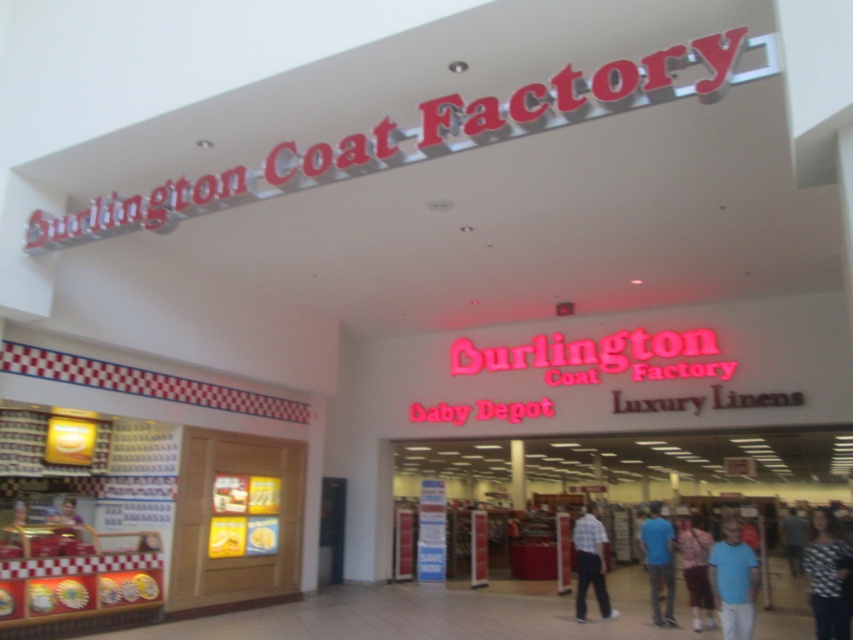
This screenshot has width=853, height=640. Identify the location of blue shirt at center. (659, 561).

Is point (657, 554) farther from camera compared to point (788, 532)?

No, it is in front of (788, 532).

Which is behind, point (654, 611) or point (801, 560)?

Positioned behind is point (801, 560).

Locate an element on the screen. blue shirt at center is located at coordinates (659, 561).

Is the position of blue cotton shirt at lower right more distant than that of blue shirt at center?

That is False.

Is point (728, 570) positioned before point (654, 620)?

Yes, point (728, 570) is closer to viewer.

What do you see at coordinates (733, 580) in the screenshot?
I see `blue cotton shirt at lower right` at bounding box center [733, 580].

You are a GUI agent. You are given a task and a screenshot of the screen. Output one action in this format:
    pyautogui.click(x=<x>, y=<y>)
    Task: Click on the blue cotton shirt at lower right
    Image resolution: width=853 pixels, height=640 pixels.
    Given the screenshot: What is the action you would take?
    pyautogui.click(x=733, y=580)

Does point (825, 509) come closer to viewer compared to point (660, 522)?

That is False.

Is patterned fabric shirt at lower right to the left of blue shirt at center from the viewer's perspective?

In fact, patterned fabric shirt at lower right is to the right of blue shirt at center.

Where is `patterned fabric shirt at lower right`? This screenshot has width=853, height=640. patterned fabric shirt at lower right is located at coordinates (827, 577).